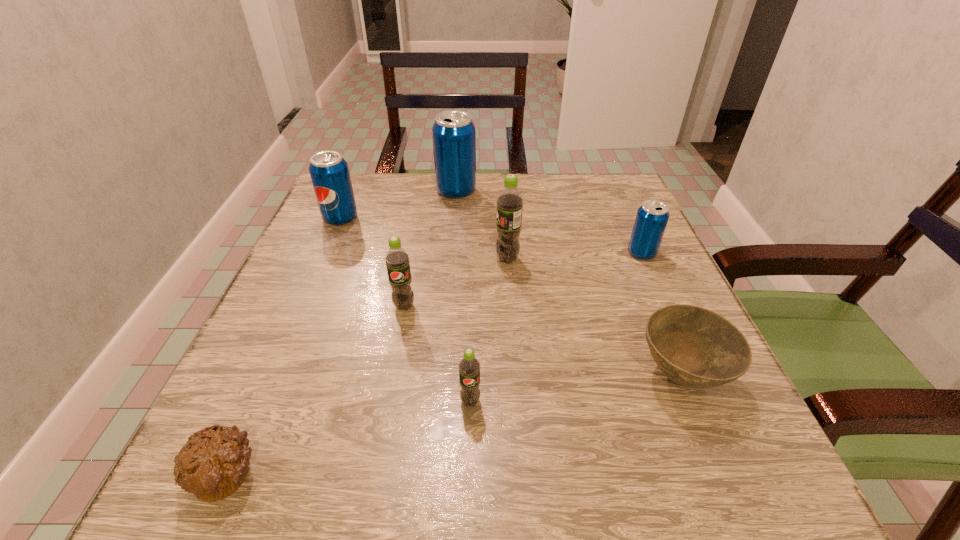
Find the location of a particular element. The width and height of the screenshot is (960, 540). the second green soda from left to right is located at coordinates (469, 366).

I want to click on the nearest green soda, so click(469, 366).

Locate an element on the screen. The width and height of the screenshot is (960, 540). the second shortest object is located at coordinates (694, 347).

I want to click on muffin, so click(213, 463).

Locate an element on the screen. the nearest object is located at coordinates (213, 463).

Locate an element on the screen. The width and height of the screenshot is (960, 540). vacant space situated 0.390m on the right of the farthest soda is located at coordinates (626, 191).

Where is `blank area located on the front label of the biggest green soda`? The image size is (960, 540). blank area located on the front label of the biggest green soda is located at coordinates (419, 259).

Identify the location of vacant region located on the front label of the biggest green soda. Image resolution: width=960 pixels, height=540 pixels. (443, 259).

Image resolution: width=960 pixels, height=540 pixels. I want to click on vacant space located on the front label of the biggest green soda, so 471,259.

This screenshot has width=960, height=540. In order to click on vacant region located 0.370m on the right of the leftmost soda in this screenshot , I will do `click(514, 218)`.